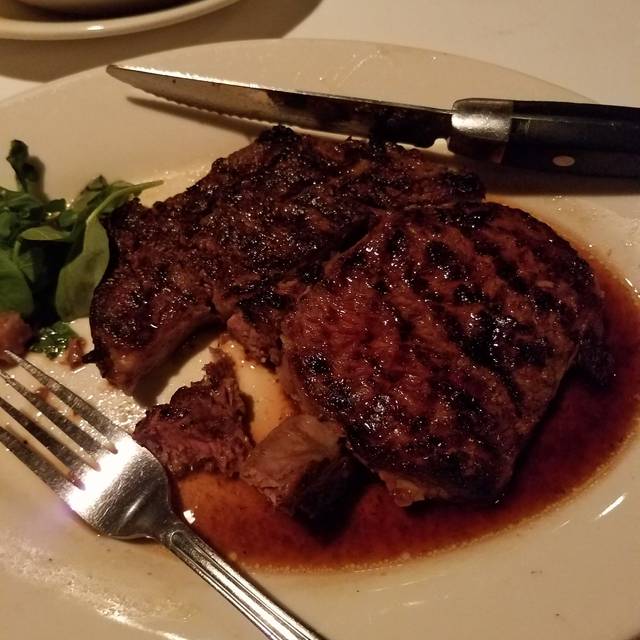
Where is `table`? Image resolution: width=640 pixels, height=640 pixels. table is located at coordinates (422, 25).